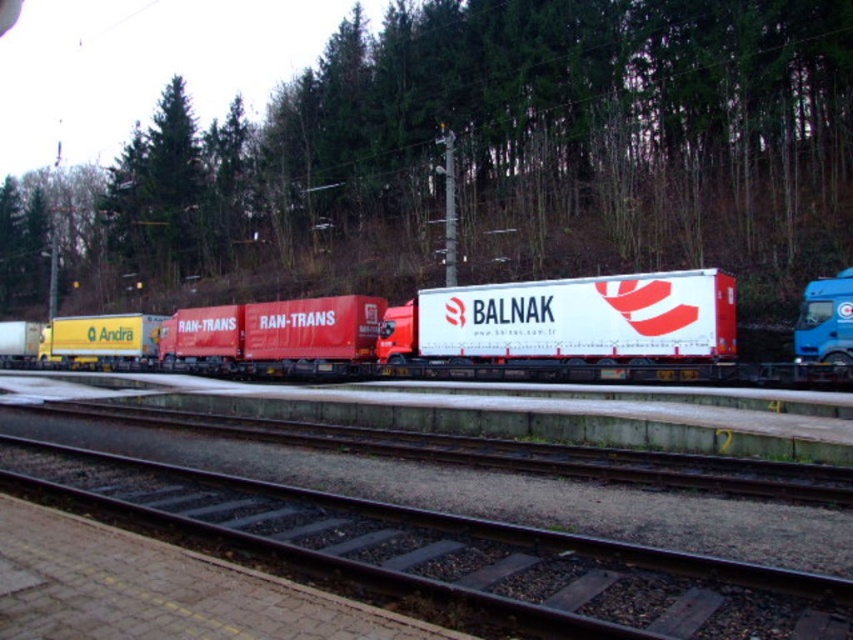
Does white glossy trailer truck at center have a smaller size compared to blue metallic truck at right?

Actually, white glossy trailer truck at center might be larger than blue metallic truck at right.

Can you confirm if white glossy trailer truck at center is taller than blue metallic truck at right?

Correct, white glossy trailer truck at center is much taller as blue metallic truck at right.

The width and height of the screenshot is (853, 640). In order to click on white glossy trailer truck at center in this screenshot , I will do 561,326.

Is point (33, 228) behind point (606, 467)?

That is True.

Does green matte tree at upper center appear on the right side of metal at center?

No, green matte tree at upper center is not to the right of metal at center.

Which is in front, point (410, 22) or point (730, 464)?

Point (730, 464)

Identify the location of green matte tree at upper center. This screenshot has height=640, width=853. (512, 140).

Does white glossy trailer at center lie in front of black metal train track at center?

No.

Describe the element at coordinates (450, 337) in the screenshot. I see `white glossy trailer at center` at that location.

Locate an element on the screen. white glossy trailer at center is located at coordinates (450, 337).